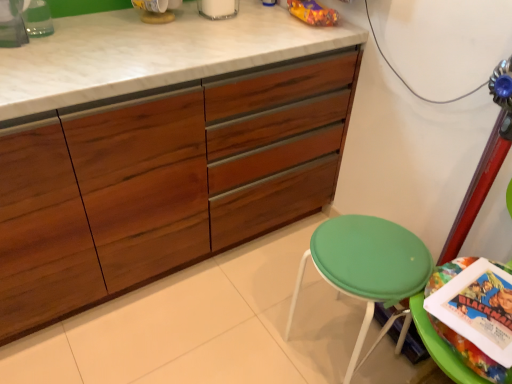
Find the location of a particular element. This screenshot has height=384, width=512. free point above wooden cabinet at center (from a real-world perspective) is located at coordinates (154, 37).